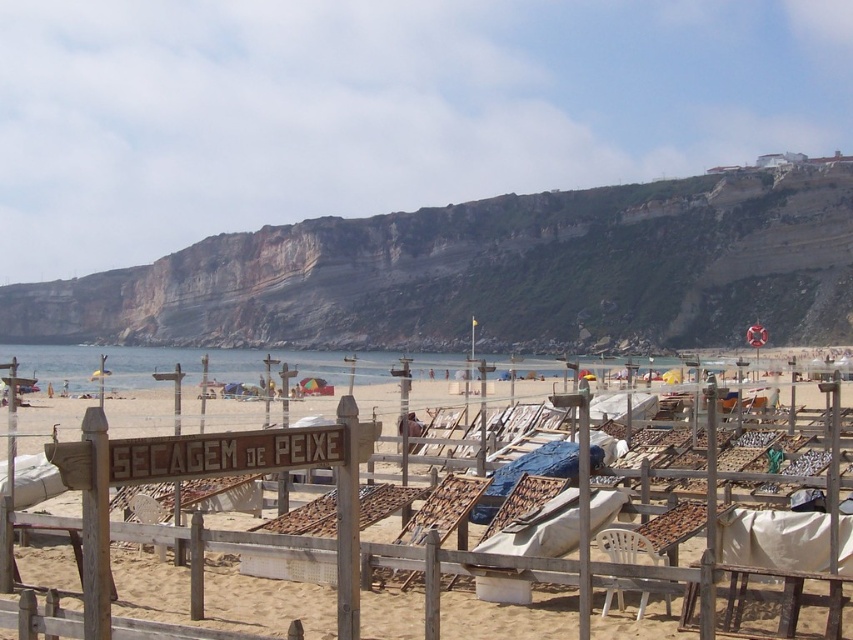
Is rugged stone cliff at upper center to the right of wooden lounge chairs at center from the viewer's perspective?

Incorrect, rugged stone cliff at upper center is not on the right side of wooden lounge chairs at center.

Is rugged stone cliff at upper center further to camera compared to wooden lounge chairs at center?

That is True.

Is point (404, 214) less distant than point (827, 536)?

No, it is behind (827, 536).

Where is `rugged stone cliff at upper center`? rugged stone cliff at upper center is located at coordinates coord(492,273).

Can you confirm if rugged stone cliff at upper center is positioned above white plastic chair at lower center?

Yes.

Between rugged stone cliff at upper center and white plastic chair at lower center, which one is positioned lower?

white plastic chair at lower center

Who is more forward, (x=341, y=276) or (x=611, y=593)?

Positioned in front is point (x=611, y=593).

Locate an element on the screen. This screenshot has width=853, height=640. rugged stone cliff at upper center is located at coordinates (492, 273).

Is wooden lounge chairs at center to the right of white plastic chair at lower center from the viewer's perspective?

In fact, wooden lounge chairs at center is to the left of white plastic chair at lower center.

Is wooden lounge chairs at center closer to camera compared to white plastic chair at lower center?

Yes, it is.

Image resolution: width=853 pixels, height=640 pixels. I want to click on wooden lounge chairs at center, so click(263, 540).